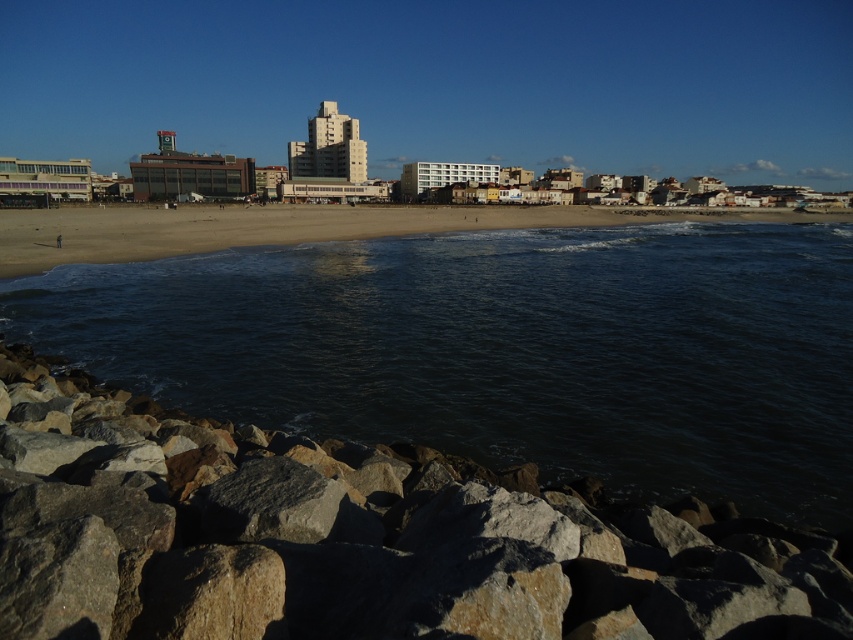
Between rough textured rock at lower left and smooth sand beach at center, which one appears on the right side from the viewer's perspective?

smooth sand beach at center

Can you confirm if rough textured rock at lower left is taller than smooth sand beach at center?

In fact, rough textured rock at lower left may be shorter than smooth sand beach at center.

Measure the distance between rough textured rock at lower left and camera.

rough textured rock at lower left and camera are 16.78 feet apart.

Where is `rough textured rock at lower left`? rough textured rock at lower left is located at coordinates (357, 538).

Based on the photo, measure the distance between point (427, 289) and camera.

Point (427, 289) and camera are 30.65 meters apart.

Between dark water at center and rough textured rock at lower left, which one appears on the left side from the viewer's perspective?

rough textured rock at lower left is more to the left.

Does point (550, 346) lie in front of point (780, 541)?

No.

At what (x,y) coordinates should I click in order to perform the action: click on dark water at center. Please return your answer as a coordinate pair (x, y). Image resolution: width=853 pixels, height=640 pixels. Looking at the image, I should click on (505, 349).

Which is more to the right, dark water at center or smooth sand beach at center?

smooth sand beach at center is more to the right.

The height and width of the screenshot is (640, 853). Describe the element at coordinates (505, 349) in the screenshot. I see `dark water at center` at that location.

Who is more distant from viewer, (766, 301) or (125, 230)?

The point (125, 230) is more distant.

Find the location of a particular element. Image resolution: width=853 pixels, height=640 pixels. dark water at center is located at coordinates (505, 349).